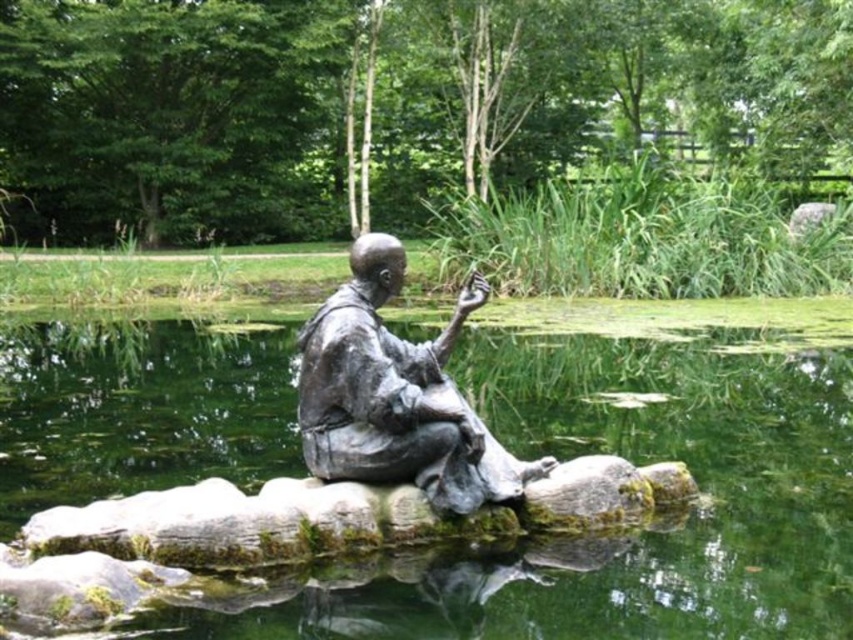
You are standing at the edge of the water in the scene and want to walk towards the statue. Which point, point (228, 360) or point (546, 461), is closer to you?

Point (228, 360) is closer to you because it is further to the viewer than point (546, 461).

You are standing at the edge of the water in the scene and want to place a small decorative stone at the exact location of point (635, 464). What object will the stone be placed on?

The small decorative stone will be placed on the green mossy rock at center located at point (635, 464).